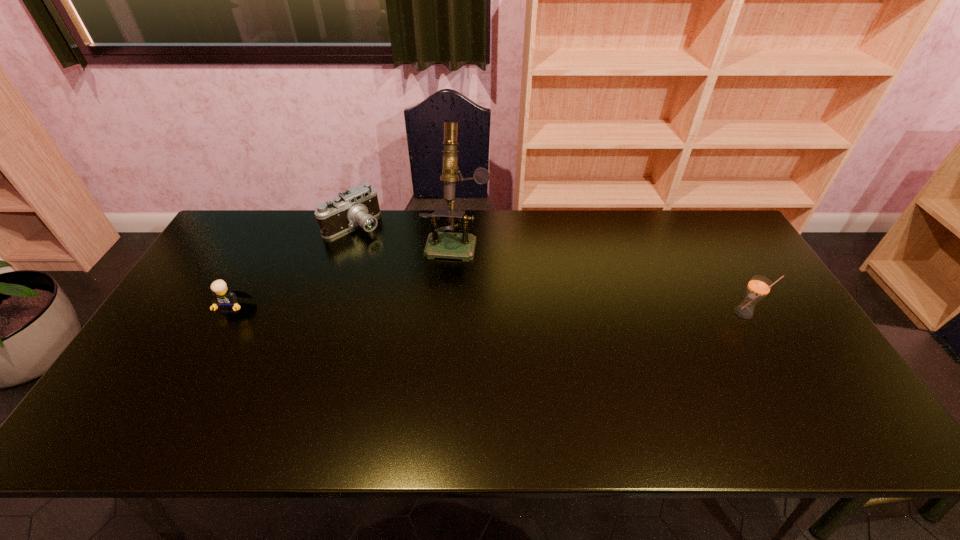
The width and height of the screenshot is (960, 540). In order to click on free space at the left edge of the desktop in this screenshot , I will do `click(252, 265)`.

You are a GUI agent. You are given a task and a screenshot of the screen. Output one action in this format:
    pyautogui.click(x=<x>, y=<y>)
    Task: Click on the vacant space at the right edge
    The height and width of the screenshot is (540, 960).
    Given the screenshot: What is the action you would take?
    pyautogui.click(x=791, y=344)

Image resolution: width=960 pixels, height=540 pixels. In the image, there is a desktop. Find the location of `vacant space at the far left corner`. vacant space at the far left corner is located at coordinates (265, 218).

Where is `blank space at the near right corner of the desktop`? blank space at the near right corner of the desktop is located at coordinates (829, 394).

Locate an element on the screen. The image size is (960, 540). unoccupied area between the second object from left to right and the straw is located at coordinates (549, 268).

At what (x,y) coordinates should I click in order to perform the action: click on vacant region between the Lego and the second object from left to right. Please return your answer as a coordinate pair (x, y). The height and width of the screenshot is (540, 960). Looking at the image, I should click on (294, 266).

Find the location of a particular element. Image resolution: width=960 pixels, height=540 pixels. empty space between the tallest object and the third object from right to left is located at coordinates (405, 233).

You are a GUI agent. You are given a task and a screenshot of the screen. Output one action in this format:
    pyautogui.click(x=<x>, y=<y>)
    Task: Click on the vacant area that lies between the second object from right to left and the straw
    
    Given the screenshot: What is the action you would take?
    pyautogui.click(x=600, y=276)

Find the location of a particular element. unoccupied position between the microscope and the rightmost object is located at coordinates (600, 276).

I want to click on free space between the second tallest object and the microscope, so click(x=600, y=276).